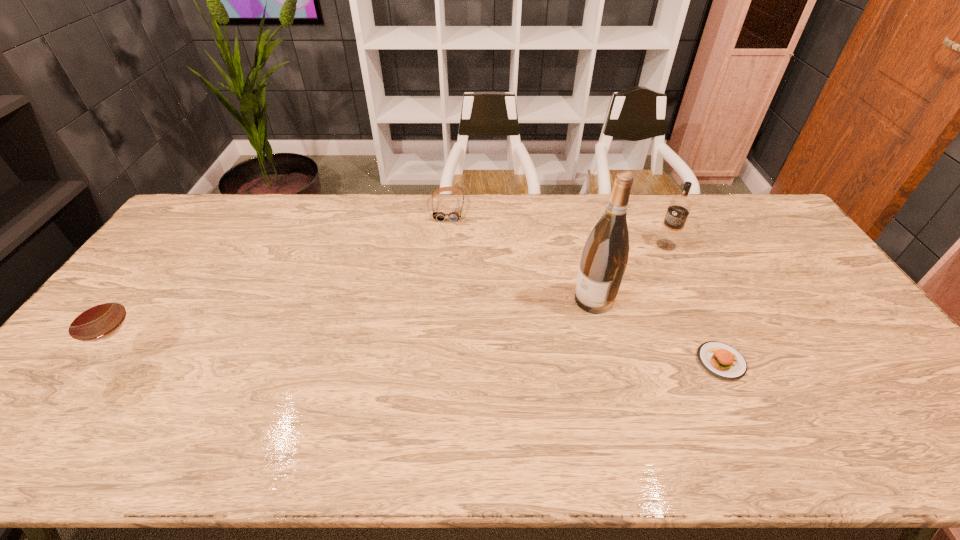
The width and height of the screenshot is (960, 540). I want to click on free location located on the back of the food, so click(668, 251).

Locate an element on the screen. free spot located on the label of the tallest object is located at coordinates (558, 320).

Identify the location of free space located on the label of the tallest object. (533, 334).

Where is `blank space located on the label of the tallest object`? This screenshot has height=540, width=960. blank space located on the label of the tallest object is located at coordinates (500, 353).

In order to click on free space located on the front-facing side of the second object from left to right in this screenshot , I will do pyautogui.click(x=446, y=236).

Where is `vacant space situated 0.350m on the front-facing side of the second object from left to right`? vacant space situated 0.350m on the front-facing side of the second object from left to right is located at coordinates (443, 293).

You are a GUI agent. You are given a task and a screenshot of the screen. Output one action in this format:
    pyautogui.click(x=<x>, y=<y>)
    Task: Click on the free space located 0.250m on the front-facing side of the second object from left to right
    The height and width of the screenshot is (540, 960).
    Given the screenshot: What is the action you would take?
    pyautogui.click(x=444, y=270)

Where is `vacant space located on the label of the fourth nearest object`? This screenshot has width=960, height=540. vacant space located on the label of the fourth nearest object is located at coordinates (600, 289).

You are a GUI agent. You are given a task and a screenshot of the screen. Output one action in this format:
    pyautogui.click(x=<x>, y=<y>)
    Task: Click on the vacant space situated 0.210m on the label of the fourth nearest object
    The width and height of the screenshot is (960, 540).
    Given the screenshot: What is the action you would take?
    pyautogui.click(x=619, y=276)

You are a GUI agent. You are given a task and a screenshot of the screen. Output one action in this format:
    pyautogui.click(x=<x>, y=<y>)
    Task: Click on the vacant point located on the label of the fourth nearest object
    This screenshot has height=540, width=960.
    Given the screenshot: What is the action you would take?
    pyautogui.click(x=640, y=262)